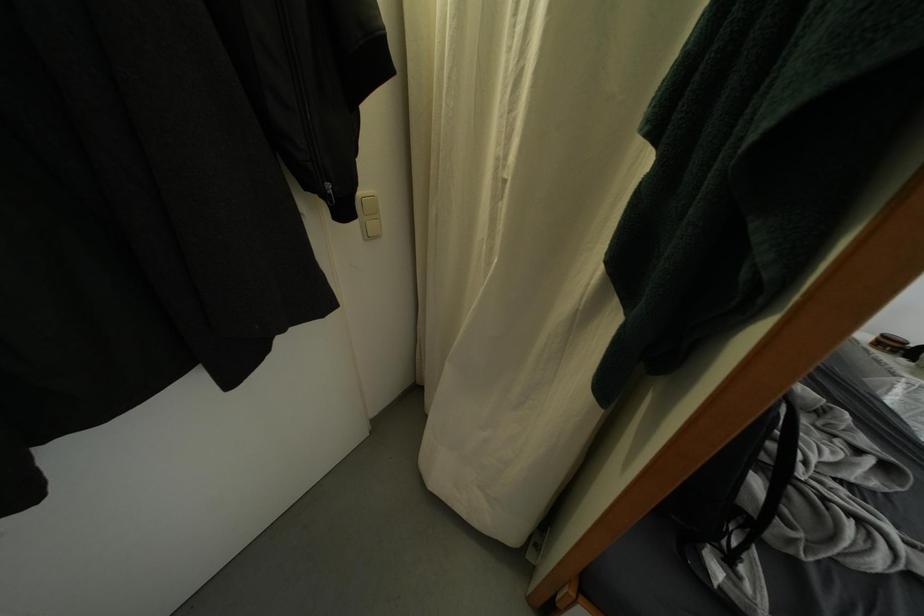
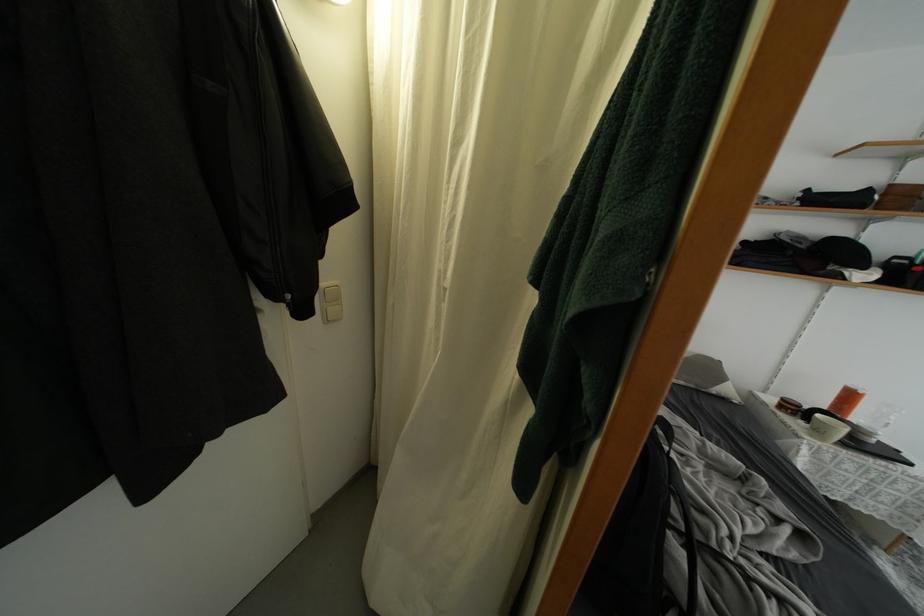
What movement of the cameraman would produce the second image?

The movement direction of the cameraman is right, backward.